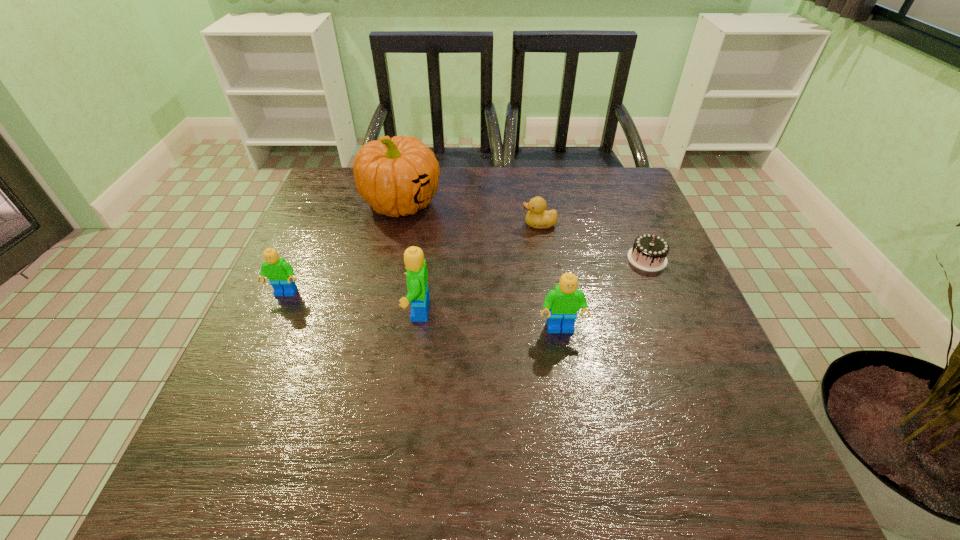
Locate an element on the screen. This screenshot has width=960, height=540. the leftmost Lego is located at coordinates (280, 273).

Where is `the shortest Lego`? This screenshot has width=960, height=540. the shortest Lego is located at coordinates (280, 273).

The image size is (960, 540). I want to click on the second Lego from right to left, so click(x=417, y=275).

This screenshot has height=540, width=960. I want to click on the second tallest Lego, so click(x=562, y=304).

This screenshot has width=960, height=540. What are the coordinates of `the third tallest object` in the screenshot? It's located at (562, 304).

Identify the location of pumpkin. (396, 176).

Where is `duckling`? The image size is (960, 540). duckling is located at coordinates (537, 217).

Identify the location of the rightmost object. (649, 252).

Where is `the fourth nearest object`? The width and height of the screenshot is (960, 540). the fourth nearest object is located at coordinates (649, 252).

The width and height of the screenshot is (960, 540). Find the location of `free space located 0.060m on the face of the third shortest object`. free space located 0.060m on the face of the third shortest object is located at coordinates (274, 321).